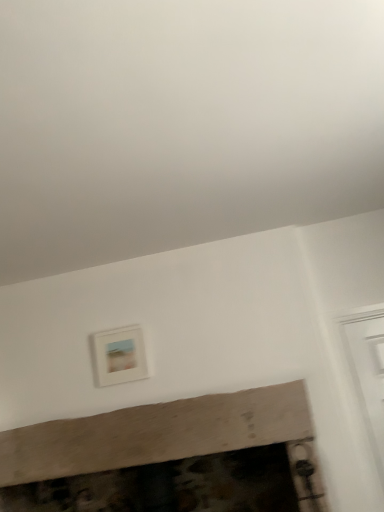
Question: Should I look upward or downward to see matte white picture frame at upper center?

Choices:
 (A) down
 (B) up

Answer: (A)